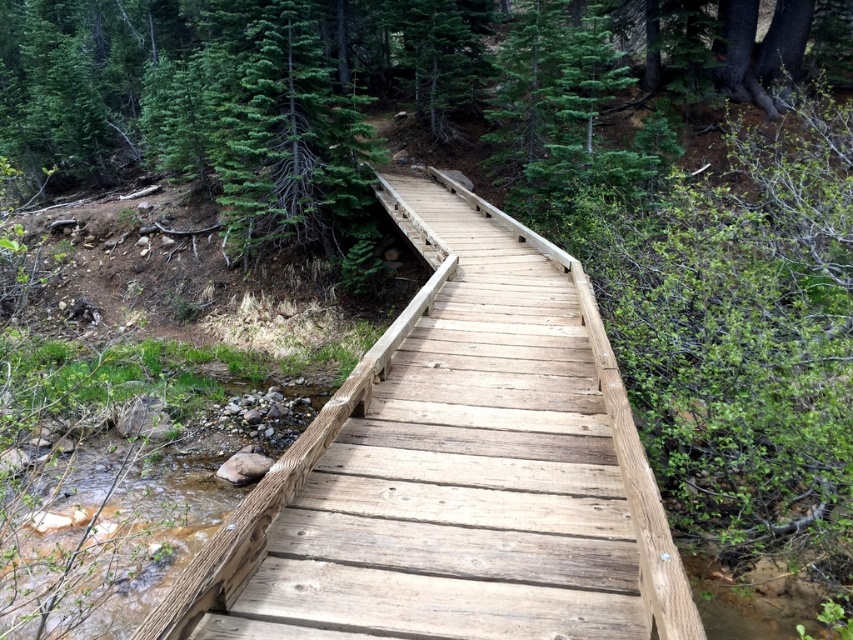
You are standing at the starting point of the boardwalk and see the point marked at coordinates [454,468]. What object is located at that point?

The natural wood bridge at center is located at point [454,468].

You are standing on the boardwalk and want to take a photo that includes both the point at coordinates (595, 436) and the point at coordinates (292, 141). Which point should you focus on to ensure both are in sharp focus?

You should focus on the point at coordinates (595, 436) because it is closer to the camera, and focusing on the closer object will keep both points in focus due to the depth of field.